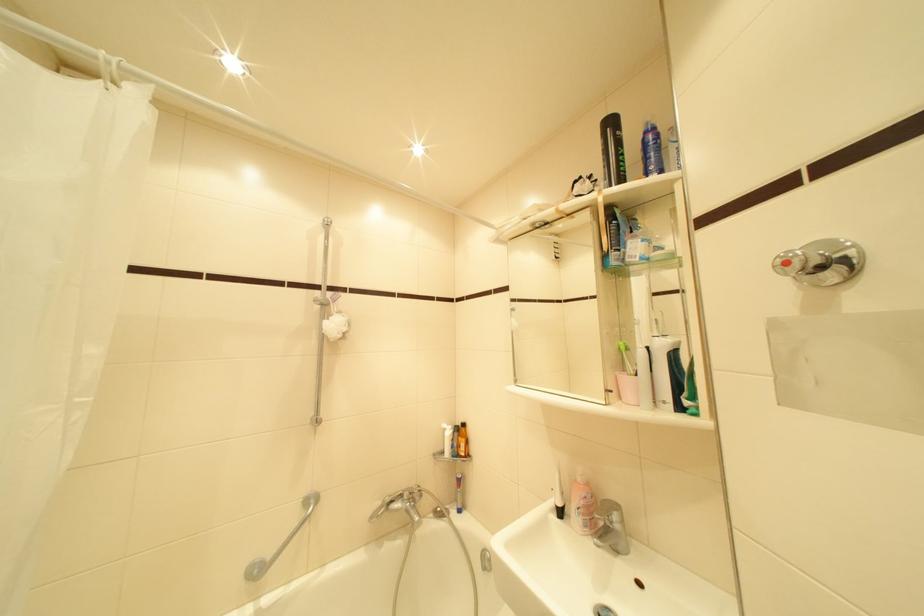
This screenshot has height=616, width=924. What do you see at coordinates (407, 504) in the screenshot?
I see `the bathtub faucet handle` at bounding box center [407, 504].